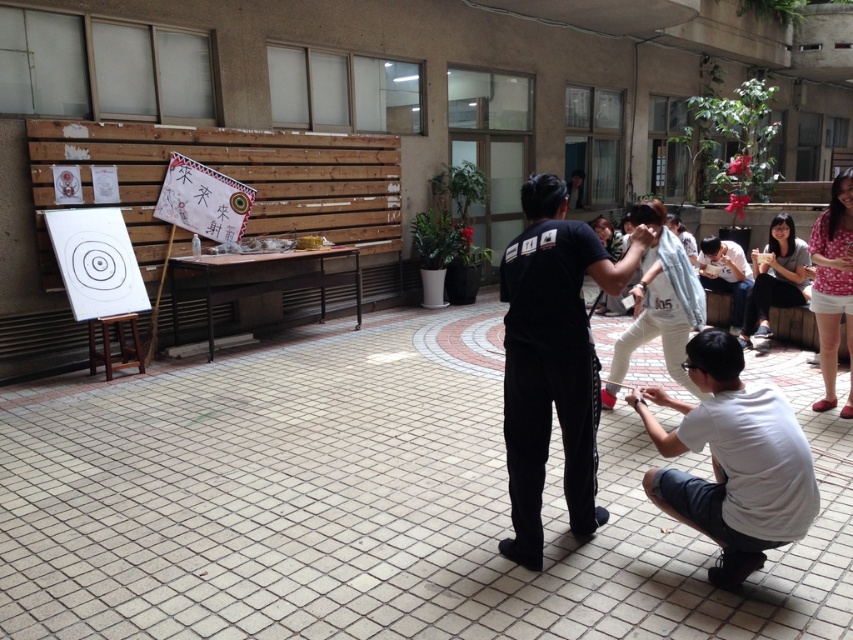
You are a photographer positioned at the center of the courtyard. You need to capture a photo that includes both the white matte shirt at lower right and the white cotton shirt at lower right. Which shirt should you adjust your camera angle to ensure the smaller one is fully visible alongside the larger one?

The white cotton shirt at lower right is smaller than the white matte shirt at lower right. To ensure both are visible, adjust the camera angle to focus on the area where both shirts are positioned, prioritizing the smaller one to avoid it being obscured by the larger one.

You are standing at the position of the camera and want to hand a water bottle to the person wearing the white matte shirt at lower right. Can you reach them without moving from your current position? The average human arm length is about 2.5 feet.

The white matte shirt at lower right is 8.35 feet away from the camera. Since the average human arm length is only 2.5 feet, you cannot reach them without moving from your current position.